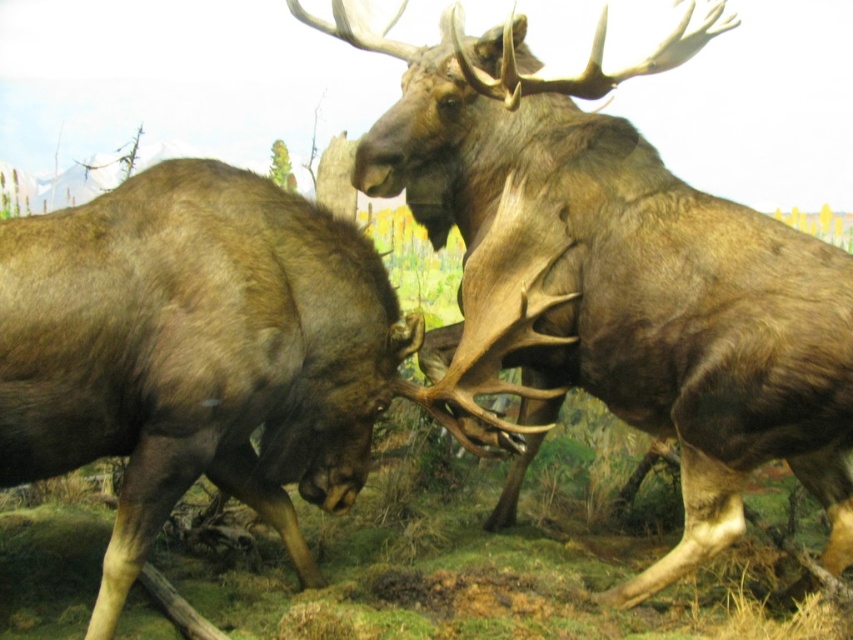
Question: Does brown furry moose at center have a greater width compared to brown velvet moose at center?

Choices:
 (A) yes
 (B) no

Answer: (A)

Question: Can you confirm if brown furry moose at center is positioned above brown velvet moose at center?

Choices:
 (A) no
 (B) yes

Answer: (B)

Question: Which point appears closest to the camera in this image?

Choices:
 (A) (799, 324)
 (B) (364, 404)

Answer: (A)

Question: Which of the following is the closest to the observer?

Choices:
 (A) (299, 333)
 (B) (828, 563)

Answer: (A)

Question: Does brown furry moose at center appear on the left side of brown velvet moose at center?

Choices:
 (A) no
 (B) yes

Answer: (A)